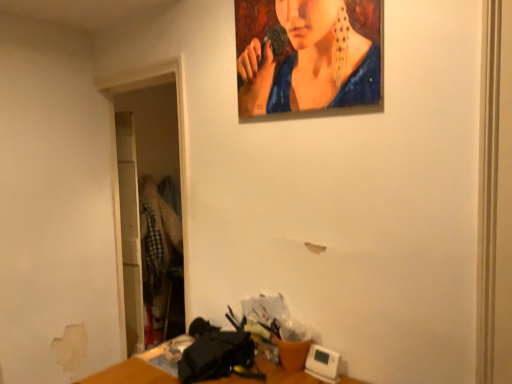
Question: Is oil painting portrait at upper center at the back of wooden table at lower center?

Choices:
 (A) no
 (B) yes

Answer: (A)

Question: Considering the relative positions of wooden table at lower center and oil painting portrait at upper center in the image provided, is wooden table at lower center to the right of oil painting portrait at upper center from the viewer's perspective?

Choices:
 (A) yes
 (B) no

Answer: (B)

Question: Does wooden table at lower center have a greater height compared to oil painting portrait at upper center?

Choices:
 (A) yes
 (B) no

Answer: (B)

Question: Considering the relative positions of wooden table at lower center and oil painting portrait at upper center in the image provided, is wooden table at lower center to the left of oil painting portrait at upper center from the viewer's perspective?

Choices:
 (A) no
 (B) yes

Answer: (B)

Question: Is wooden table at lower center completely or partially outside of oil painting portrait at upper center?

Choices:
 (A) yes
 (B) no

Answer: (A)

Question: From the image's perspective, is wooden table at lower center located beneath oil painting portrait at upper center?

Choices:
 (A) yes
 (B) no

Answer: (A)

Question: Is oil painting portrait at upper center to the right of wooden table at lower center from the viewer's perspective?

Choices:
 (A) no
 (B) yes

Answer: (B)

Question: Are oil painting portrait at upper center and wooden table at lower center far apart?

Choices:
 (A) yes
 (B) no

Answer: (A)

Question: From a real-world perspective, is oil painting portrait at upper center located beneath wooden table at lower center?

Choices:
 (A) yes
 (B) no

Answer: (B)

Question: From the image's perspective, is oil painting portrait at upper center on top of wooden table at lower center?

Choices:
 (A) yes
 (B) no

Answer: (A)

Question: Does oil painting portrait at upper center have a larger size compared to wooden table at lower center?

Choices:
 (A) no
 (B) yes

Answer: (A)

Question: From the image's perspective, is oil painting portrait at upper center below wooden table at lower center?

Choices:
 (A) yes
 (B) no

Answer: (B)

Question: Would you say oil painting portrait at upper center is inside or outside wooden table at lower center?

Choices:
 (A) inside
 (B) outside

Answer: (B)